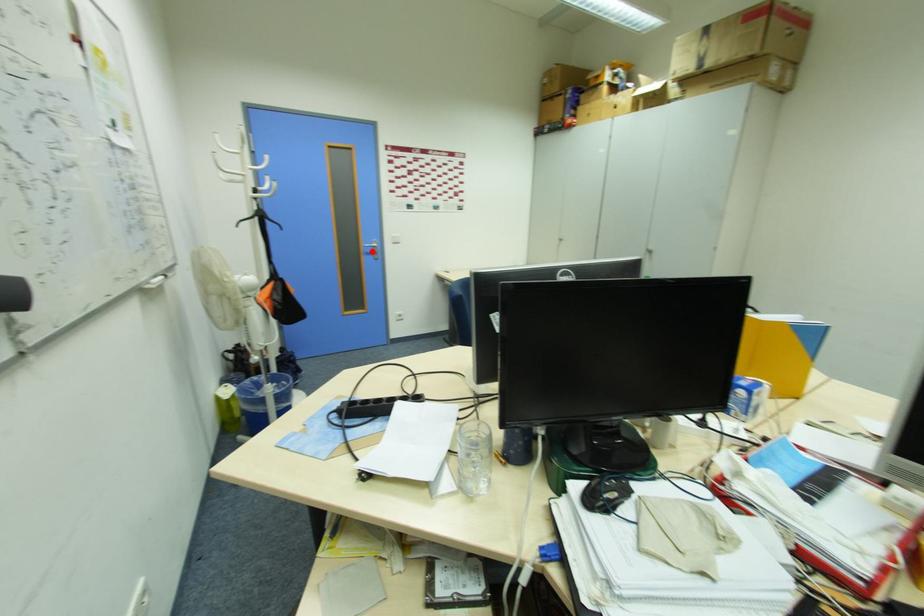
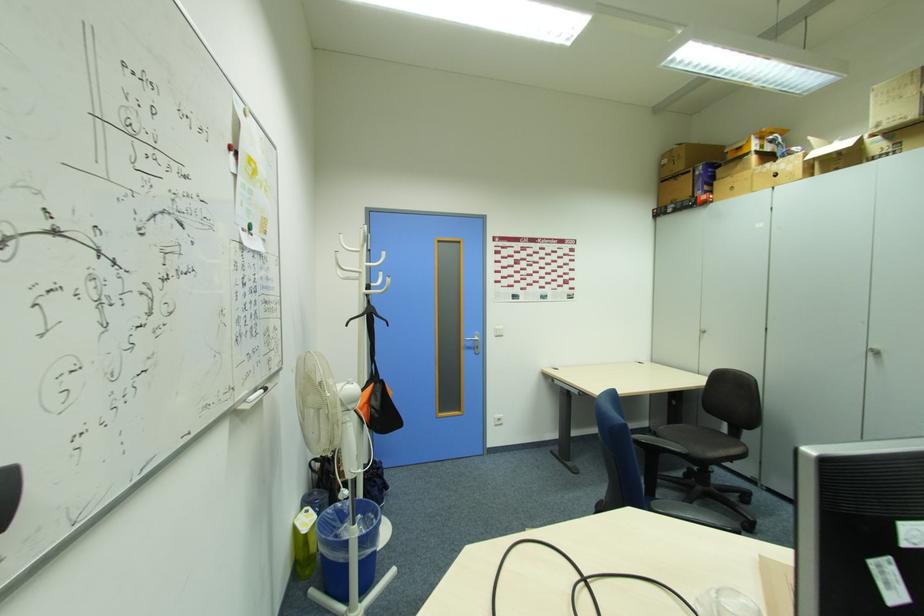
The point at the highlighted location is marked in the first image. Where is the corresponding point in the second image?

(472, 346)